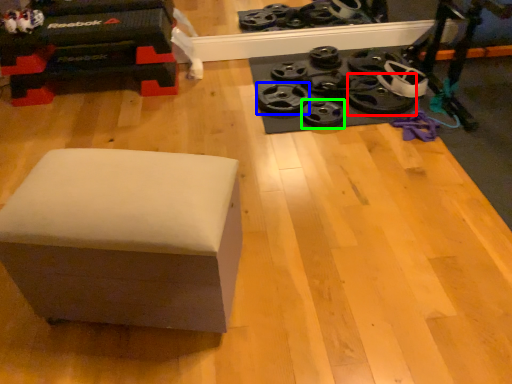
Question: Which is farther away from wheel (highlighted by a red box)? wheel (highlighted by a blue box) or wheel (highlighted by a green box)?

Choices:
 (A) wheel
 (B) wheel

Answer: (A)